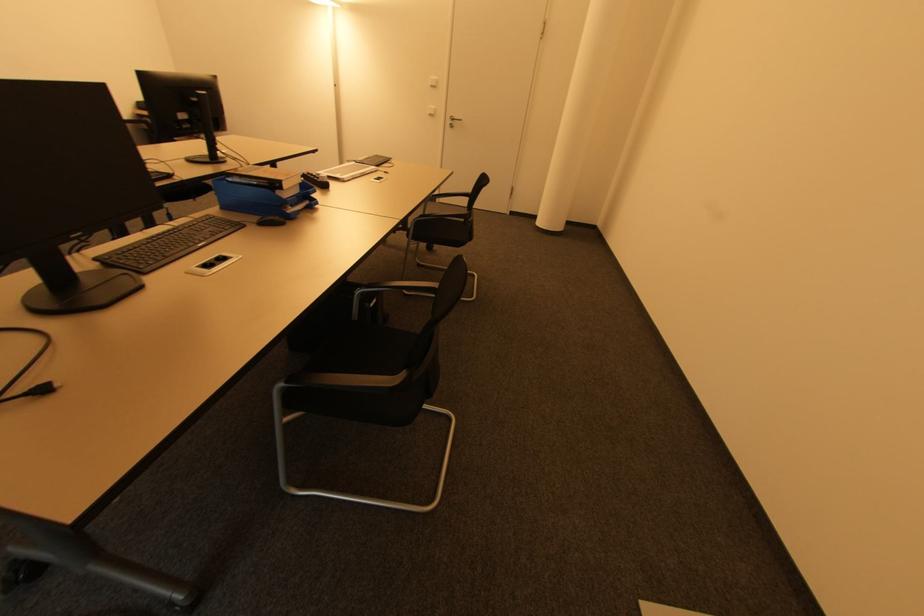
What are the coordinates of `stacked books` in the screenshot? It's located at (263, 192).